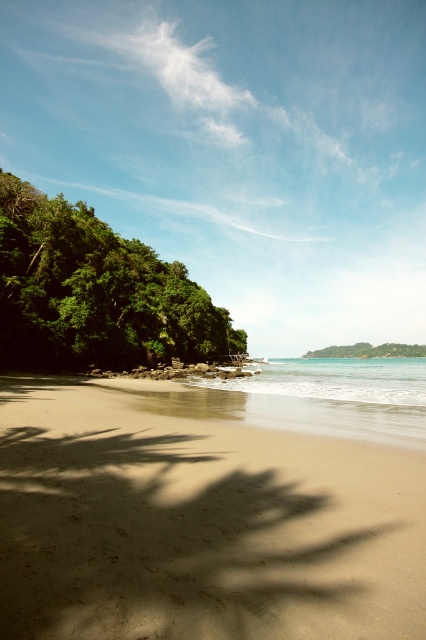
Consider the image. Does sandy beach at lower left have a lesser height compared to green leafy tree at center?

Correct, sandy beach at lower left is not as tall as green leafy tree at center.

The width and height of the screenshot is (426, 640). I want to click on sandy beach at lower left, so click(x=198, y=524).

This screenshot has width=426, height=640. I want to click on sandy beach at lower left, so click(198, 524).

The width and height of the screenshot is (426, 640). What do you see at coordinates (94, 292) in the screenshot?
I see `green leafy tree at left` at bounding box center [94, 292].

Locate an element on the screen. green leafy tree at left is located at coordinates pyautogui.click(x=94, y=292).

Find the location of a particular element. Image resolution: width=426 pixels, height=640 pixels. green leafy tree at left is located at coordinates (94, 292).

The width and height of the screenshot is (426, 640). What do you see at coordinates (198, 524) in the screenshot?
I see `sandy beach at lower left` at bounding box center [198, 524].

Is point (166, 435) positioned behind point (412, 385)?

No.

Between point (204, 576) and point (276, 394), which one is positioned behind?

Positioned behind is point (276, 394).

Identify the location of sandy beach at lower left. (198, 524).